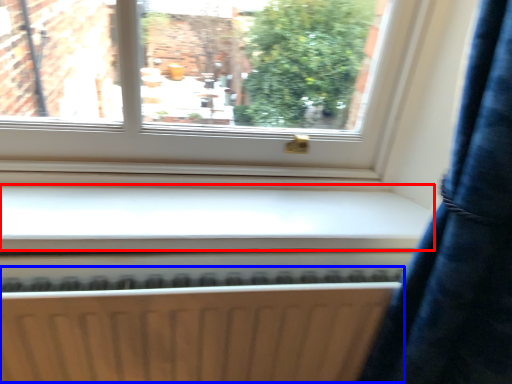
Question: Which object is closer to the camera taking this photo, window sill (highlighted by a red box) or radiator (highlighted by a blue box)?

Choices:
 (A) window sill
 (B) radiator

Answer: (B)